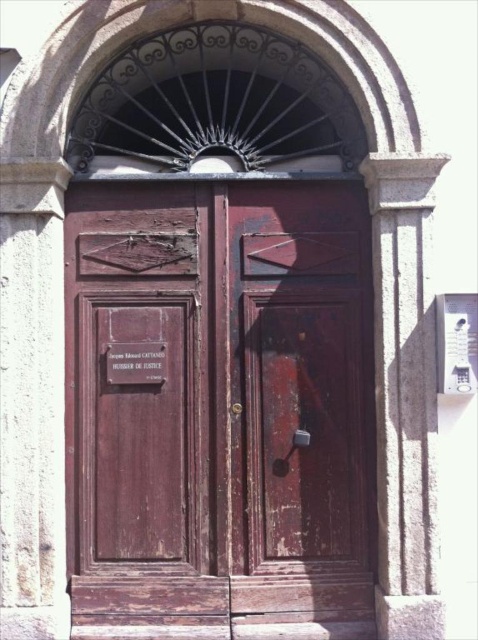
Does rusty wood door at center lie in front of matte wood sign at center?

Yes, it is.

Locate an element on the screen. The height and width of the screenshot is (640, 478). rusty wood door at center is located at coordinates (220, 406).

Between metallic gray plaque at upper right and matte wood sign at center, which one appears on the right side from the viewer's perspective?

metallic gray plaque at upper right

How far apart are metallic gray plaque at upper right and matte wood sign at center?

metallic gray plaque at upper right is 4.44 feet away from matte wood sign at center.

Which is in front, point (462, 346) or point (162, 376)?

Point (462, 346)

Find the location of a particular element. metallic gray plaque at upper right is located at coordinates (456, 342).

The height and width of the screenshot is (640, 478). Describe the element at coordinates (220, 406) in the screenshot. I see `rusty wood door at center` at that location.

Is rusty wood door at center smaller than metallic gray plaque at upper right?

Incorrect, rusty wood door at center is not smaller in size than metallic gray plaque at upper right.

Locate an element on the screen. rusty wood door at center is located at coordinates (220, 406).

Find the location of `rusty wood door at center`. rusty wood door at center is located at coordinates (220, 406).